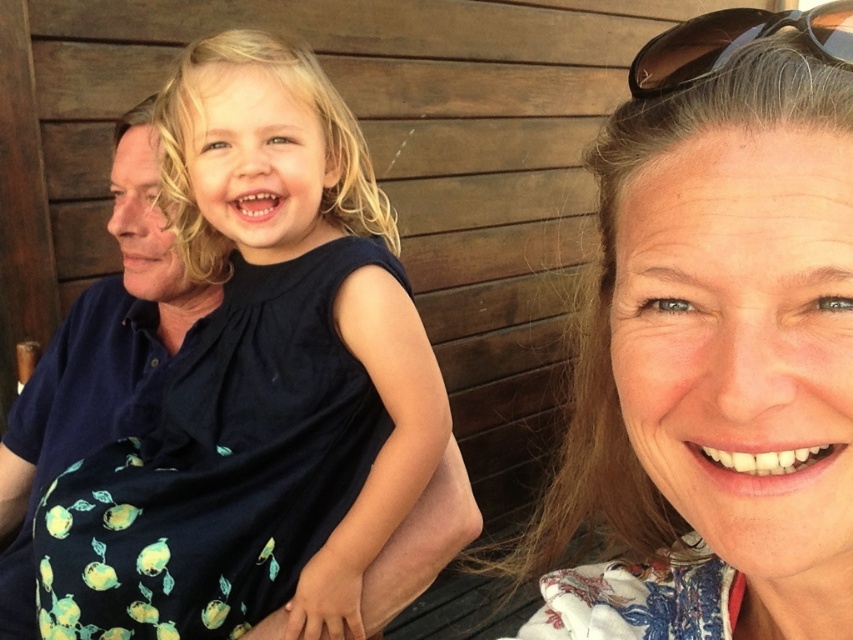
Question: Which point is farther to the camera?

Choices:
 (A) floral fabric at upper right
 (B) dark blue fabric dress at center

Answer: (B)

Question: Which of the following is the farthest from the observer?

Choices:
 (A) (747, 420)
 (B) (328, 438)
 (C) (746, 10)

Answer: (B)

Question: Which of the following is the farthest from the observer?

Choices:
 (A) (607, 320)
 (B) (816, 28)
 (C) (386, 388)

Answer: (C)

Question: Does floral fabric at upper right have a larger size compared to dark blue fabric dress at center?

Choices:
 (A) yes
 (B) no

Answer: (B)

Question: Considering the relative positions of floral fabric at upper right and black plastic sunglasses at upper right in the image provided, where is floral fabric at upper right located with respect to black plastic sunglasses at upper right?

Choices:
 (A) left
 (B) right

Answer: (B)

Question: Does floral fabric at upper right appear on the right side of black plastic sunglasses at upper right?

Choices:
 (A) yes
 (B) no

Answer: (A)